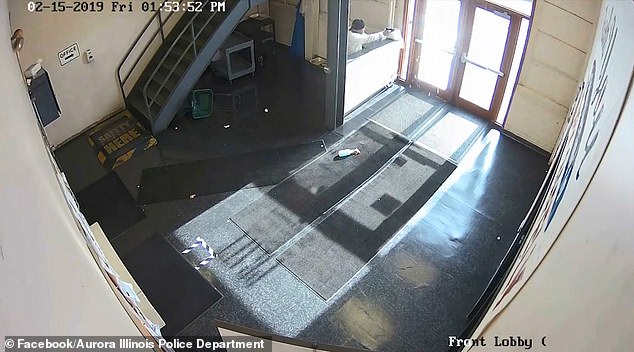
This screenshot has width=634, height=352. What are the coordinates of `spray bottle` in the screenshot? It's located at (339, 148).